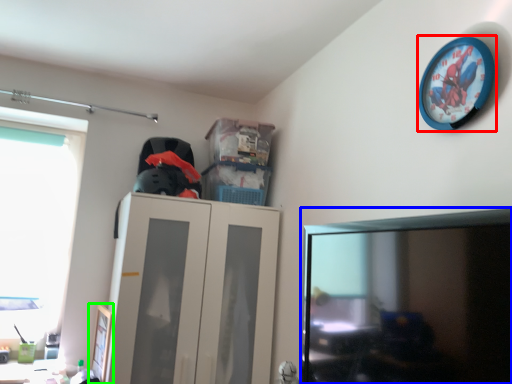
Question: Which is nearer to the wall clock (highlighted by a red box)? computer monitor (highlighted by a blue box) or picture frame (highlighted by a green box).

Choices:
 (A) computer monitor
 (B) picture frame

Answer: (A)